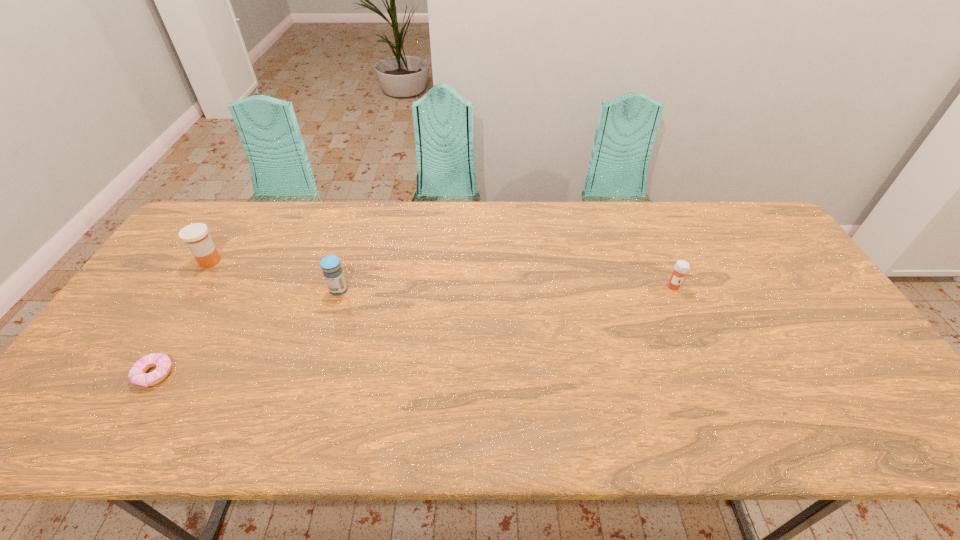
I want to click on the leftmost medicine, so click(196, 237).

Find the location of a particular element. the farthest medicine is located at coordinates point(196,237).

Where is `the second medicine from right to left`? The width and height of the screenshot is (960, 540). the second medicine from right to left is located at coordinates (331, 266).

Locate an element on the screen. Image resolution: width=960 pixels, height=540 pixels. the third tallest object is located at coordinates (681, 267).

What are the coordinates of `the rightmost medicine` in the screenshot? It's located at (681, 267).

This screenshot has height=540, width=960. I want to click on the shortest object, so click(x=137, y=375).

Locate an element on the screen. This screenshot has width=960, height=540. the nearest object is located at coordinates [x=137, y=375].

I want to click on free region located on the label of the leftmost medicine, so [x=326, y=261].

The image size is (960, 540). Identify the location of free space located 0.140m on the left of the second object from right to left. (280, 290).

Where is `vacant space located on the label side of the third tallest object`? The width and height of the screenshot is (960, 540). vacant space located on the label side of the third tallest object is located at coordinates (721, 399).